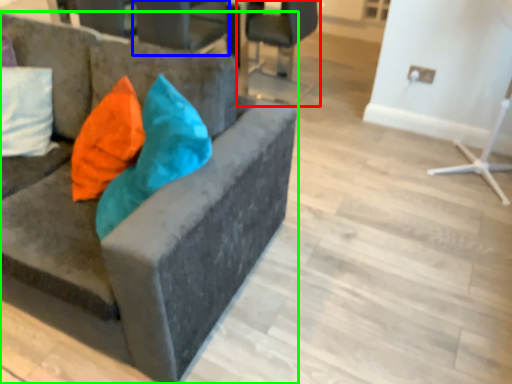
Question: Which object is the closest to the chair (highlighted by a red box)? Choose among these: chair (highlighted by a blue box) or chair (highlighted by a green box).

Choices:
 (A) chair
 (B) chair

Answer: (A)